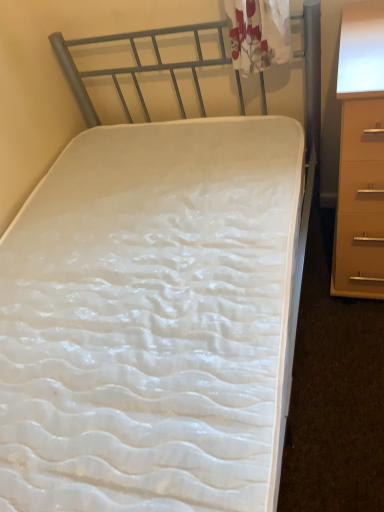
What do you see at coordinates (360, 156) in the screenshot?
I see `beige wood chest of drawers at right` at bounding box center [360, 156].

I want to click on beige wood chest of drawers at right, so click(x=360, y=156).

Measure the distance between beige wood chest of drawers at right and camera.

beige wood chest of drawers at right and camera are 36.82 inches apart.

Measure the distance between point (360, 279) and camera.

A distance of 1.41 meters exists between point (360, 279) and camera.

Where is `beige wood chest of drawers at right`? This screenshot has height=512, width=384. beige wood chest of drawers at right is located at coordinates pyautogui.click(x=360, y=156).